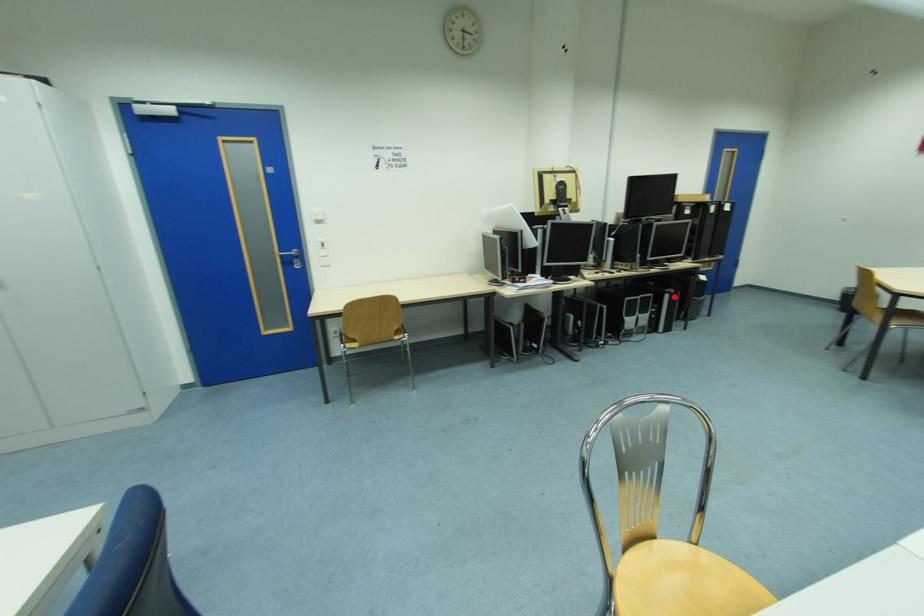
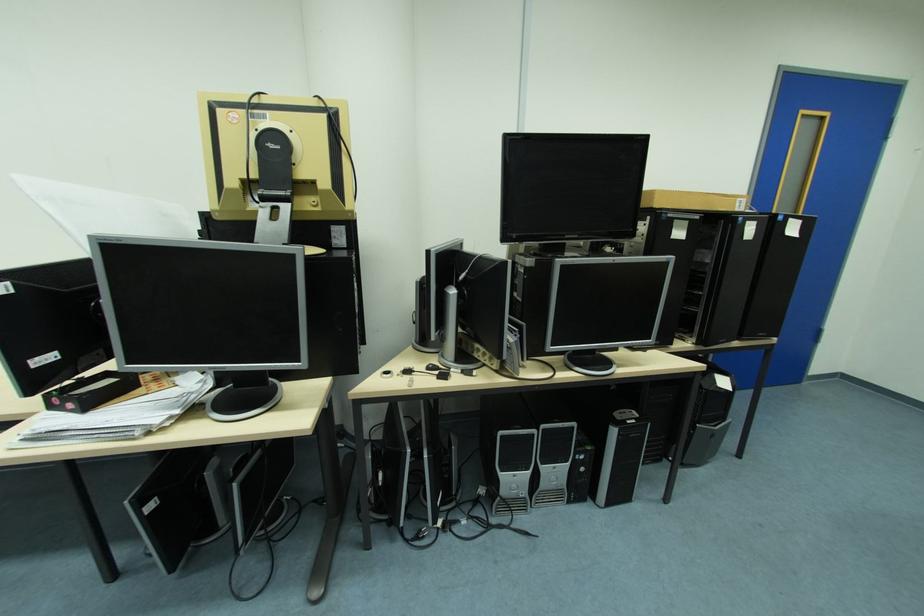
Find the pixel in the second image that matches the highlighted location in the first image.

(621, 432)